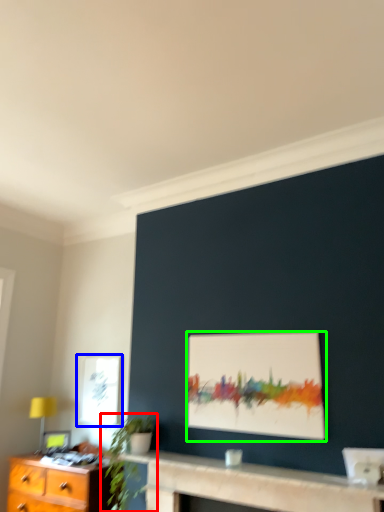
Question: Which object is positioned farthest from houseplant (highlighted by a red box)? Select from window (highlighted by a blue box) and picture frame (highlighted by a green box).

Choices:
 (A) window
 (B) picture frame

Answer: (B)